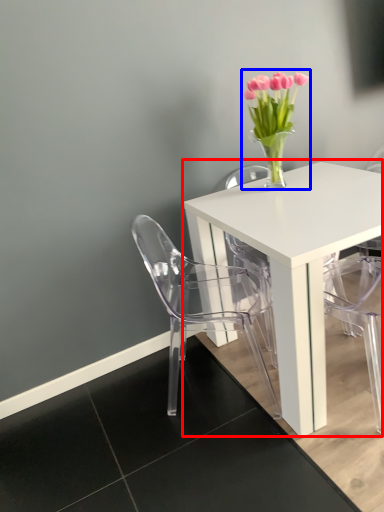
Question: Which object is closer to the camera taking this photo, table (highlighted by a red box) or floral arrangement (highlighted by a blue box)?

Choices:
 (A) table
 (B) floral arrangement

Answer: (A)